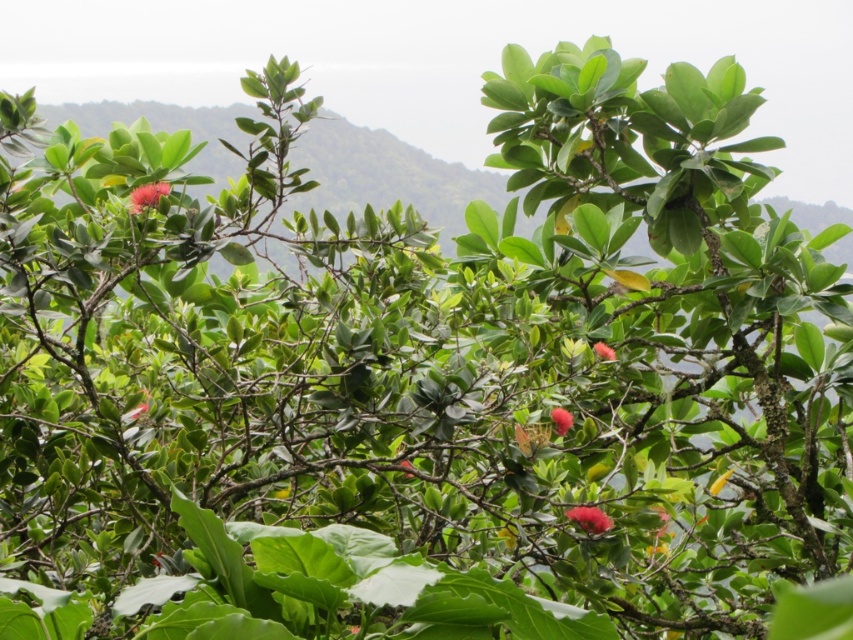
You are a botanist examining two flowers in the image. The smooth red flower at center and the smooth pink flower at center. Which one has a bigger size?

The smooth red flower at center is larger in size than the smooth pink flower at center.